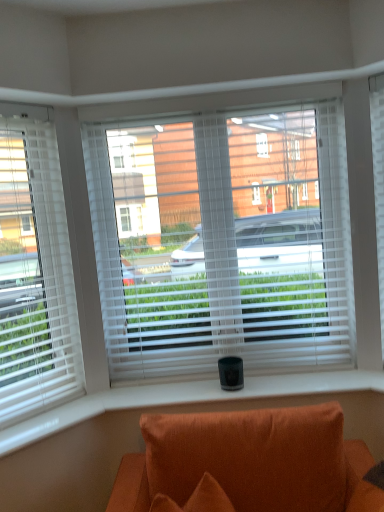
What is the approximate width of white blinds at center, which is counted as the second window, starting from the left?

white blinds at center, which is counted as the second window, starting from the left, is 13.27 centimeters in width.

This screenshot has height=512, width=384. What do you see at coordinates (35, 271) in the screenshot?
I see `white blinds at left, the second window viewed from the right` at bounding box center [35, 271].

The width and height of the screenshot is (384, 512). What are the coordinates of `orange fabric couch at lower center` in the screenshot? It's located at [x=246, y=460].

Would you consider white blinds at left, which ranks as the first window in left-to-right order, to be distant from white blinds at center, which is counted as the second window, starting from the left?

No, white blinds at left, which ranks as the first window in left-to-right order, is not far from white blinds at center, which is counted as the second window, starting from the left.

Is white blinds at left, the second window viewed from the right, situated inside white blinds at center, which is counted as the second window, starting from the left, or outside?

white blinds at left, the second window viewed from the right, is located beyond the bounds of white blinds at center, which is counted as the second window, starting from the left.

Based on the photo, how different are the orientations of white blinds at left, which ranks as the first window in left-to-right order, and white blinds at center, the 1th window viewed from the right, in degrees?

white blinds at left, which ranks as the first window in left-to-right order, and white blinds at center, the 1th window viewed from the right, are facing 45.5 degrees away from each other.

In order to click on window on the right side of white blinds at left, the second window viewed from the right in this screenshot , I will do `click(223, 242)`.

From the image's perspective, between white blinds at center, which is counted as the second window, starting from the left, and white blinds at left, which ranks as the first window in left-to-right order, which one is located above?

white blinds at center, which is counted as the second window, starting from the left, is shown above in the image.

Does white blinds at center, the 1th window viewed from the right, have a larger size compared to white blinds at left, which ranks as the first window in left-to-right order?

Yes.

Is white blinds at center, which is counted as the second window, starting from the left, positioned beyond the bounds of white blinds at left, which ranks as the first window in left-to-right order?

Yes, white blinds at center, which is counted as the second window, starting from the left, is not within white blinds at left, which ranks as the first window in left-to-right order.

Consider the image. Is white textured blind at right smaller than white blinds at left, the second window viewed from the right?

Yes, white textured blind at right is smaller than white blinds at left, the second window viewed from the right.

Is white textured blind at right in front of or behind white blinds at left, which ranks as the first window in left-to-right order, in the image?

In the image, white textured blind at right appears behind white blinds at left, which ranks as the first window in left-to-right order.

Is white blinds at left, which ranks as the first window in left-to-right order, surrounded by white textured blind at right?

No, white blinds at left, which ranks as the first window in left-to-right order, is located outside of white textured blind at right.

From a real-world perspective, is white textured blind at right positioned above or below white blinds at left, which ranks as the first window in left-to-right order?

Clearly, from a real-world perspective, white textured blind at right is below white blinds at left, which ranks as the first window in left-to-right order.

Would you say orange fabric couch at lower center is to the left or to the right of white blinds at center, the 1th window viewed from the right, in the picture?

orange fabric couch at lower center is positioned on white blinds at center, the 1th window viewed from the right,'s right side.

From the picture: Is orange fabric couch at lower center bigger or smaller than white blinds at center, which is counted as the second window, starting from the left?

Clearly, orange fabric couch at lower center is larger in size than white blinds at center, which is counted as the second window, starting from the left.

Is orange fabric couch at lower center surrounding white blinds at center, which is counted as the second window, starting from the left?

Actually, white blinds at center, which is counted as the second window, starting from the left, is outside orange fabric couch at lower center.

Which is in front, point (258, 505) or point (149, 320)?

Positioned in front is point (258, 505).

Are white blinds at center, the 1th window viewed from the right, and orange fabric couch at lower center far apart?

No, white blinds at center, the 1th window viewed from the right, is in close proximity to orange fabric couch at lower center.

From a real-world perspective, is white blinds at center, the 1th window viewed from the right, positioned above or below orange fabric couch at lower center?

Clearly, from a real-world perspective, white blinds at center, the 1th window viewed from the right, is above orange fabric couch at lower center.

Does point (251, 343) appear closer or farther from the camera than point (302, 486)?

Point (251, 343) is farther from the camera than point (302, 486).

Which object is further away from the camera taking this photo, white blinds at center, the 1th window viewed from the right, or orange fabric couch at lower center?

Positioned behind is white blinds at center, the 1th window viewed from the right.

How different are the orientations of white textured blind at right and orange fabric couch at lower center in degrees?

The angular difference between white textured blind at right and orange fabric couch at lower center is 41.1 degrees.

Is white textured blind at right far from orange fabric couch at lower center?

No.

Is white textured blind at right looking in the opposite direction of orange fabric couch at lower center?

No.

Can you confirm if white textured blind at right is shorter than orange fabric couch at lower center?

In fact, white textured blind at right may be taller than orange fabric couch at lower center.

Is point (210, 354) positioned before point (383, 245)?

No, (210, 354) is further to viewer.

Which is correct: white blinds at center, which is counted as the second window, starting from the left, is inside white textured blind at right, or outside of it?

white blinds at center, which is counted as the second window, starting from the left, is outside white textured blind at right.

Considering the sizes of white blinds at center, which is counted as the second window, starting from the left, and white textured blind at right in the image, is white blinds at center, which is counted as the second window, starting from the left, bigger or smaller than white textured blind at right?

In the image, white blinds at center, which is counted as the second window, starting from the left, appears to be larger than white textured blind at right.

Which object is positioned more to the right, white blinds at center, the 1th window viewed from the right, or white textured blind at right?

white textured blind at right.

This screenshot has width=384, height=512. I want to click on window that appears on the left of white blinds at center, which is counted as the second window, starting from the left, so click(x=35, y=271).

Find the location of a particular element. Image resolution: width=384 pixels, height=512 pixels. window behind the white blinds at left, which ranks as the first window in left-to-right order is located at coordinates (223, 242).

Considering their positions, is orange fabric couch at lower center positioned further to white blinds at left, which ranks as the first window in left-to-right order, than white textured blind at right?

The object further to white blinds at left, which ranks as the first window in left-to-right order, is white textured blind at right.

Estimate the real-world distances between objects in this image. Which object is further from white textured blind at right, white blinds at center, the 1th window viewed from the right, or white blinds at left, the second window viewed from the right?

Based on the image, white blinds at left, the second window viewed from the right, appears to be further to white textured blind at right.

From the image, which object appears to be farther from white blinds at center, which is counted as the second window, starting from the left, white blinds at left, which ranks as the first window in left-to-right order, or orange fabric couch at lower center?

Based on the image, orange fabric couch at lower center appears to be further to white blinds at center, which is counted as the second window, starting from the left.

Which object lies further to the anchor point white blinds at center, the 1th window viewed from the right, white textured blind at right or orange fabric couch at lower center?

orange fabric couch at lower center is positioned further to the anchor white blinds at center, the 1th window viewed from the right.

Estimate the real-world distances between objects in this image. Which object is closer to white textured blind at right, orange fabric couch at lower center or white blinds at left, the second window viewed from the right?

orange fabric couch at lower center is closer to white textured blind at right.

Considering their positions, is orange fabric couch at lower center positioned closer to white blinds at left, which ranks as the first window in left-to-right order, than white blinds at center, the 1th window viewed from the right?

white blinds at center, the 1th window viewed from the right, lies closer to white blinds at left, which ranks as the first window in left-to-right order, than the other object.

Considering their positions, is white blinds at center, the 1th window viewed from the right, positioned further to white blinds at left, the second window viewed from the right, than orange fabric couch at lower center?

Among the two, orange fabric couch at lower center is located further to white blinds at left, the second window viewed from the right.

Which object lies further to the anchor point white blinds at center, which is counted as the second window, starting from the left, white blinds at left, which ranks as the first window in left-to-right order, or white textured blind at right?

Among the two, white textured blind at right is located further to white blinds at center, which is counted as the second window, starting from the left.

Where is `studio couch located between white blinds at left, which ranks as the first window in left-to-right order, and white textured blind at right in the left-right direction`? This screenshot has height=512, width=384. studio couch located between white blinds at left, which ranks as the first window in left-to-right order, and white textured blind at right in the left-right direction is located at coordinates (246, 460).

At what (x,y) coordinates should I click in order to perform the action: click on window between white blinds at left, the second window viewed from the right, and orange fabric couch at lower center, in the horizontal direction. Please return your answer as a coordinate pair (x, y). This screenshot has width=384, height=512. Looking at the image, I should click on (223, 242).

Identify the location of window between white blinds at left, which ranks as the first window in left-to-right order, and white textured blind at right from left to right. The width and height of the screenshot is (384, 512). (223, 242).